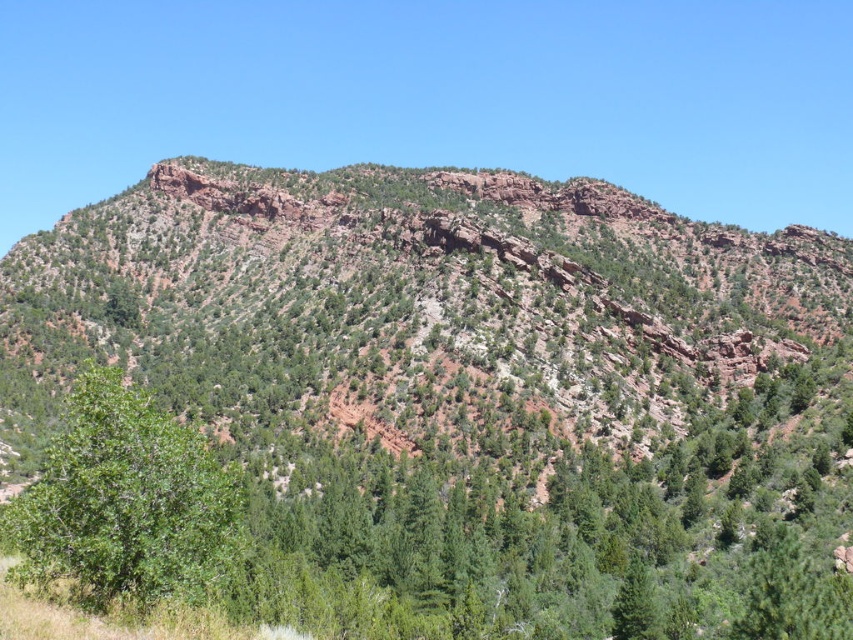
You are a hiker standing at the base of the rustic rock mountain at center. You want to reach the summit. Based on the image, which direction should you head to climb the mountain?

The rustic rock mountain at center is located at point coordinates (416, 308), so you should head towards the center of the image to climb the mountain.

You are a hiker planning to traverse between the green leafy tree at center and the green leafy tree at lower left. Given that your average walking pace is 1.5 meters per second, how many seconds will it take you to walk directly between them?

The distance between the green leafy tree at center and the green leafy tree at lower left is 22.98 meters. At a pace of 1.5 meters per second, it would take approximately 15.32 seconds to walk directly between them.

You are a hiker planning to climb the rustic rock mountain at center and the green leafy tree at center. Which one would require more effort due to its size?

The rustic rock mountain at center is bigger than the green leafy tree at center, so climbing the rustic rock mountain at center would require more effort due to its larger size.